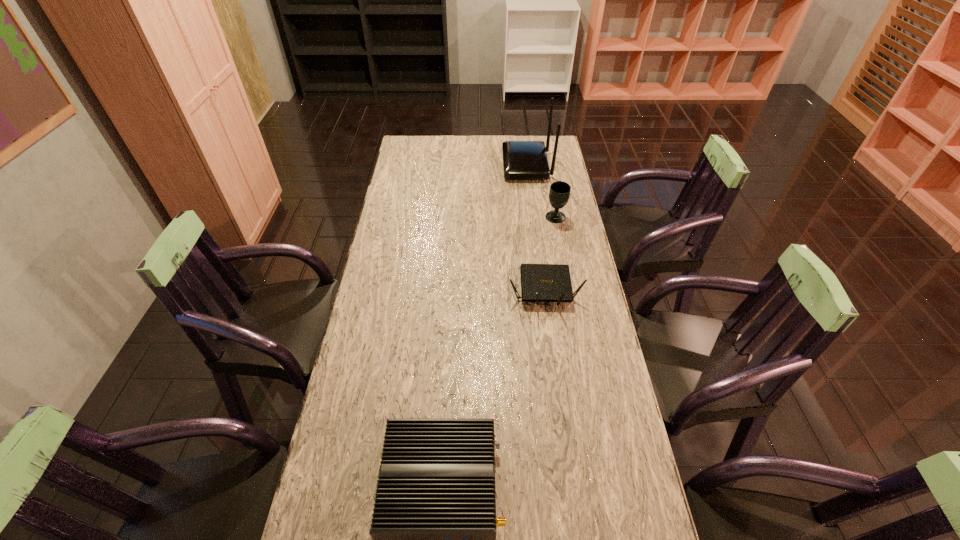
Find the location of a particular element. The height and width of the screenshot is (540, 960). the tallest router is located at coordinates (522, 160).

You are a GUI agent. You are given a task and a screenshot of the screen. Output one action in this format:
    pyautogui.click(x=<x>, y=<y>)
    Task: Click on the farthest router
    The height and width of the screenshot is (540, 960).
    Given the screenshot: What is the action you would take?
    pyautogui.click(x=522, y=160)

This screenshot has width=960, height=540. Find the location of `chalice`. chalice is located at coordinates (559, 193).

Find the location of a particular element. the third shortest object is located at coordinates (559, 193).

This screenshot has width=960, height=540. Identify the location of the third farthest object. pos(539,282).

Find the location of a particular element. The width and height of the screenshot is (960, 540). vacant space located on the front-facing side of the farthest object is located at coordinates (450, 166).

Locate an element on the screen. The width and height of the screenshot is (960, 540). vacant space located on the front-facing side of the farthest object is located at coordinates (450, 166).

Identify the location of vacant space situated on the front-facing side of the farthest object. This screenshot has height=540, width=960. (448, 166).

You are a GUI agent. You are given a task and a screenshot of the screen. Output one action in this format:
    pyautogui.click(x=<x>, y=<y>)
    Task: Click on the vacant area situated 0.050m on the back of the third shortest object
    
    Given the screenshot: What is the action you would take?
    pyautogui.click(x=553, y=204)

You are a GUI agent. You are given a task and a screenshot of the screen. Output one action in this format:
    pyautogui.click(x=<x>, y=<y>)
    Task: Click on the free space located 0.220m on the front of the second nearest object
    The image size is (960, 540).
    Given the screenshot: What is the action you would take?
    pyautogui.click(x=556, y=376)